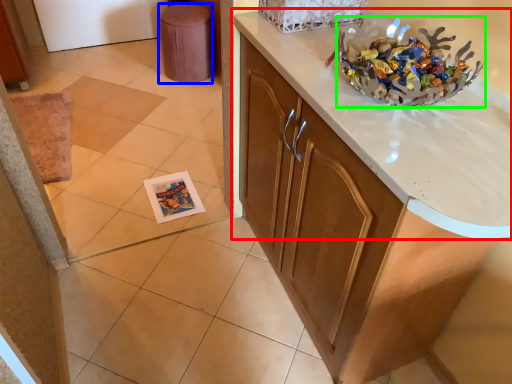
Question: Based on their relative distances, which object is nearer to countertop (highlighted by a red box)? Choose from stool (highlighted by a blue box) and stuff (highlighted by a green box).

Choices:
 (A) stool
 (B) stuff

Answer: (B)